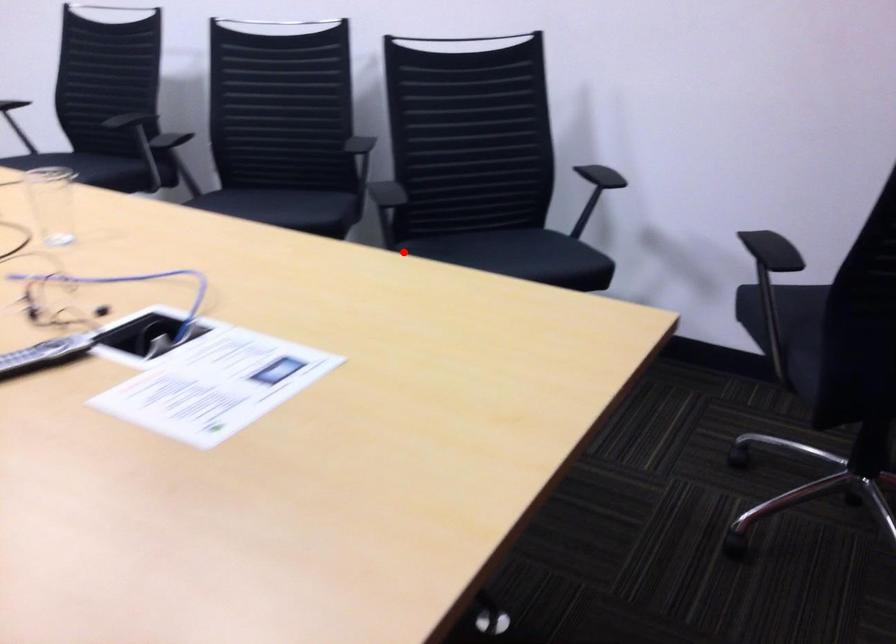
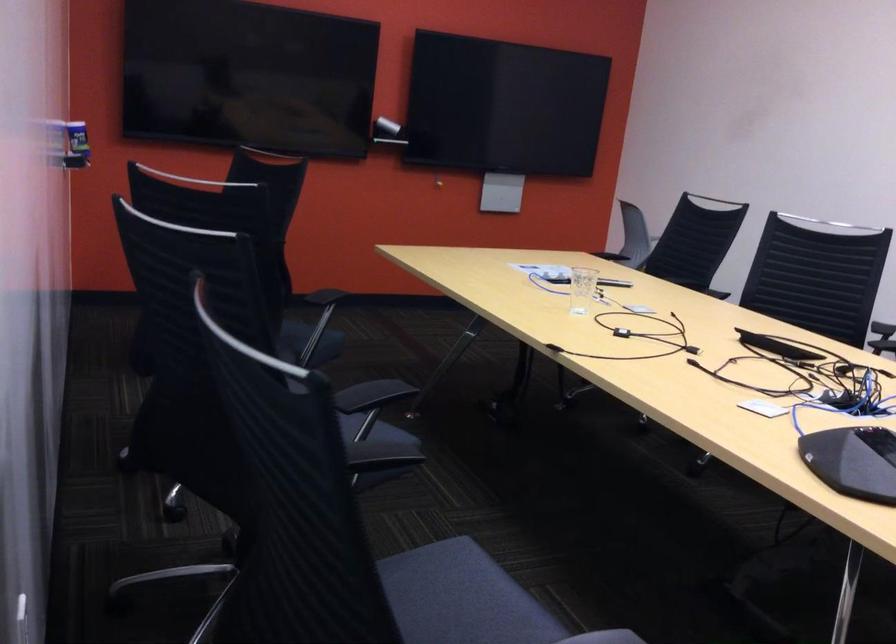
Question: I am providing you with two images of the same scene from different viewpoints. Given a red point in image1, look at the same physical point in image2. Is it:

Choices:
 (A) Closer to the viewpoint
 (B) Farther from the viewpoint

Answer: (B)